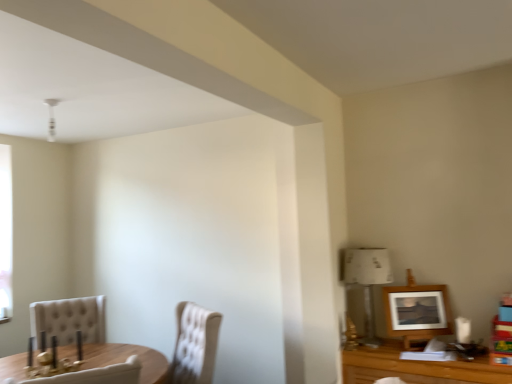
Question: From a real-world perspective, is white paper lampshade at right beneath beige tufted chair at lower left, which is the 2th chair from right to left?

Choices:
 (A) yes
 (B) no

Answer: (B)

Question: From the image's perspective, is white paper lampshade at right beneath beige tufted chair at lower left, the 1th chair when ordered from left to right?

Choices:
 (A) no
 (B) yes

Answer: (A)

Question: Considering the relative sizes of white paper lampshade at right and beige tufted chair at lower left, which is the 2th chair from right to left, in the image provided, is white paper lampshade at right thinner than beige tufted chair at lower left, which is the 2th chair from right to left,?

Choices:
 (A) yes
 (B) no

Answer: (A)

Question: Is white paper lampshade at right closer to the viewer compared to beige tufted chair at lower left, the 1th chair when ordered from left to right?

Choices:
 (A) yes
 (B) no

Answer: (A)

Question: Is white paper lampshade at right looking in the opposite direction of beige tufted chair at lower left, the 1th chair when ordered from left to right?

Choices:
 (A) yes
 (B) no

Answer: (B)

Question: Is point (433, 301) closer or farther from the camera than point (373, 342)?

Choices:
 (A) closer
 (B) farther

Answer: (A)

Question: From the image's perspective, is wooden picture frame at upper right positioned above or below white paper lampshade at right?

Choices:
 (A) below
 (B) above

Answer: (A)

Question: Is wooden picture frame at upper right wider or thinner than white paper lampshade at right?

Choices:
 (A) wide
 (B) thin

Answer: (B)

Question: Would you say wooden picture frame at upper right is to the left or to the right of white paper lampshade at right in the picture?

Choices:
 (A) left
 (B) right

Answer: (B)

Question: Considering the positions of beige tufted chair at lower left, which is the 2th chair from right to left, and wooden picture frame at upper right in the image, is beige tufted chair at lower left, which is the 2th chair from right to left, wider or thinner than wooden picture frame at upper right?

Choices:
 (A) thin
 (B) wide

Answer: (B)

Question: Considering the positions of beige tufted chair at lower left, the 1th chair when ordered from left to right, and wooden picture frame at upper right in the image, is beige tufted chair at lower left, the 1th chair when ordered from left to right, taller or shorter than wooden picture frame at upper right?

Choices:
 (A) short
 (B) tall

Answer: (B)

Question: In terms of size, does beige tufted chair at lower left, the 1th chair when ordered from left to right, appear bigger or smaller than wooden picture frame at upper right?

Choices:
 (A) big
 (B) small

Answer: (A)

Question: Is beige tufted chair at lower left, the 1th chair when ordered from left to right, in front of or behind wooden picture frame at upper right in the image?

Choices:
 (A) behind
 (B) front

Answer: (A)

Question: In terms of height, does beige tufted chair at lower left, which is the 2th chair from right to left, look taller or shorter compared to tufted fabric chair at lower left, marked as the 1th chair in a right-to-left arrangement?

Choices:
 (A) tall
 (B) short

Answer: (B)

Question: Is beige tufted chair at lower left, the 1th chair when ordered from left to right, situated inside tufted fabric chair at lower left, marked as the 1th chair in a right-to-left arrangement, or outside?

Choices:
 (A) outside
 (B) inside

Answer: (A)